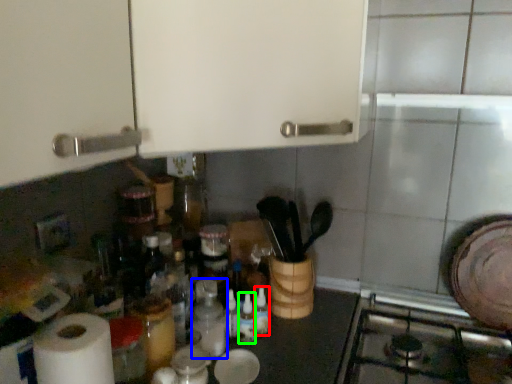
Question: Estimate the real-world distances between objects in this image. Which object is farther from bottle (highlighted by a red box), bottle (highlighted by a blue box) or bottle (highlighted by a green box)?

Choices:
 (A) bottle
 (B) bottle

Answer: (A)